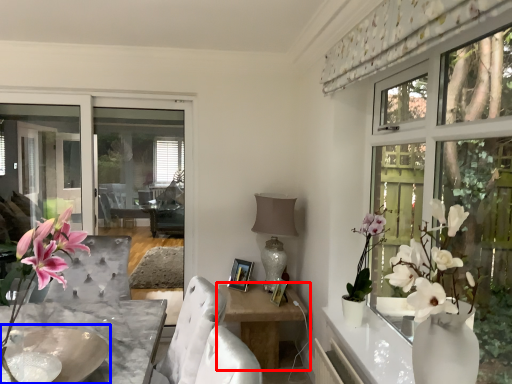
Question: Which object is further to the camera taking this photo, table (highlighted by a red box) or round table (highlighted by a blue box)?

Choices:
 (A) table
 (B) round table

Answer: (A)